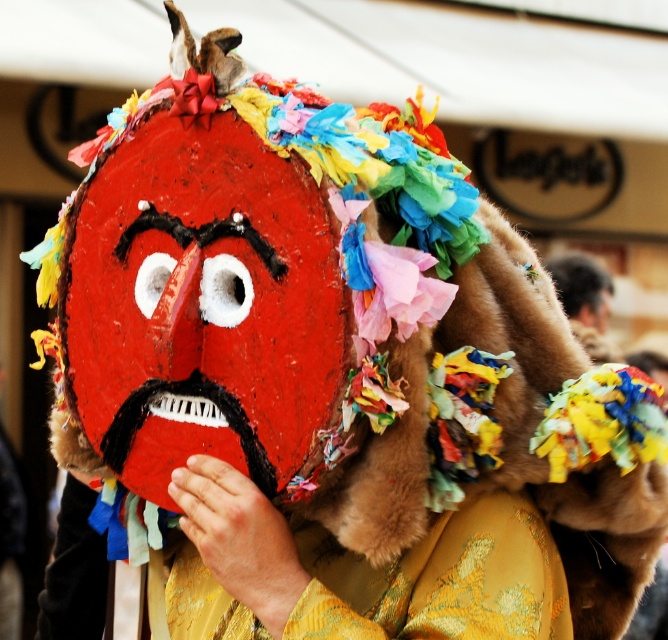
In the scene shown: You are an artist creating a display for a cultural festival. You have a furry head at upper right and a multicolored paper mask at center. Which object should you place closer to the front of the display to ensure both are visible?

You should place the furry head at upper right closer to the front of the display because it is smaller than the multicolored paper mask at center, ensuring both are visible.

Where is the matte red mask at center located in the image?

The matte red mask at center is located at point (178,320) in the image.